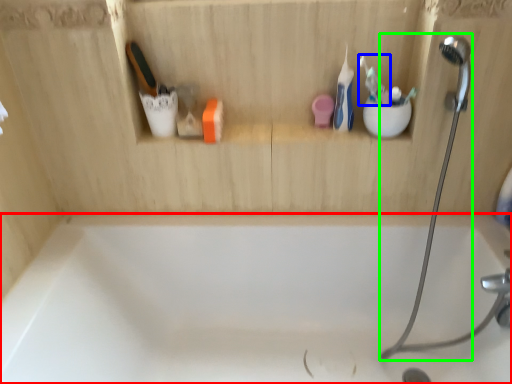
Question: Which object is positioned closest to bathtub (highlighted by a red box)? Select from toothbrush (highlighted by a blue box) and shower (highlighted by a green box).

Choices:
 (A) toothbrush
 (B) shower

Answer: (B)